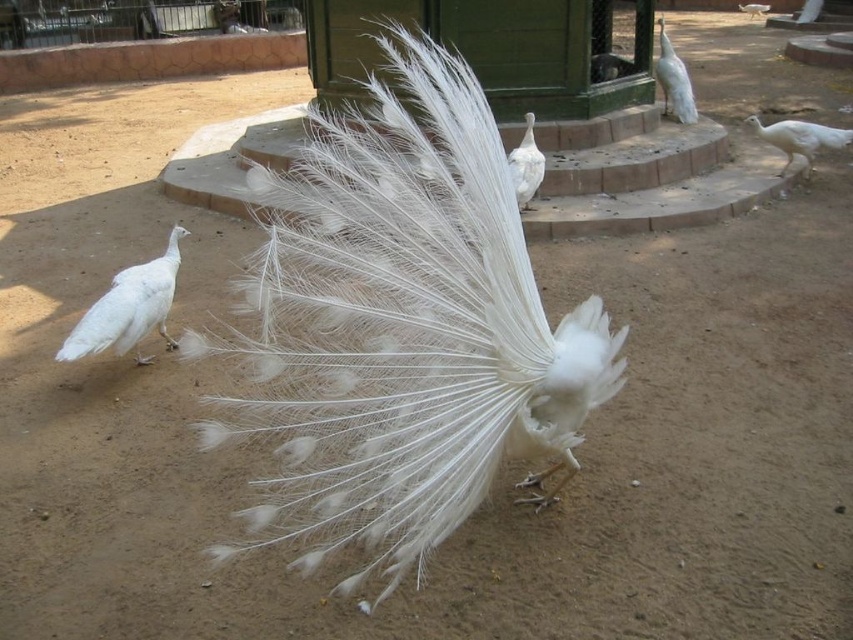
Is point (495, 444) positioned behind point (683, 116)?

No, (495, 444) is closer to viewer.

Identify the location of white feathered peacock at center. (401, 326).

Is point (445, 141) behind point (94, 339)?

No, (445, 141) is in front of (94, 339).

Between white feathered peacock at center and white feathered peacock at left, which one has more height?

white feathered peacock at center

Is point (405, 84) less distant than point (125, 320)?

That is False.

Image resolution: width=853 pixels, height=640 pixels. I want to click on white feathered peacock at center, so click(x=401, y=326).

Does point (519, 204) come farther from viewer compared to point (743, 8)?

No, it is not.

Which is in front, point (524, 116) or point (761, 12)?

Point (524, 116) is in front.

Identify the location of white feathered bird at center. (526, 164).

What are the coordinates of `white feathered bird at center` in the screenshot? It's located at (526, 164).